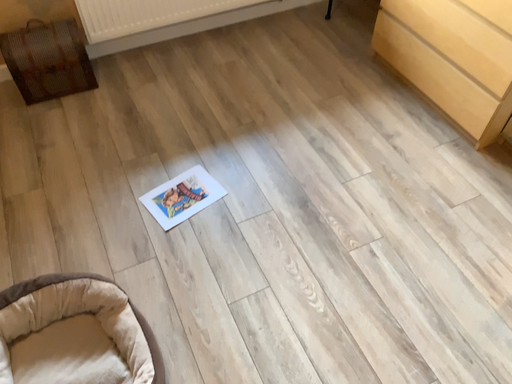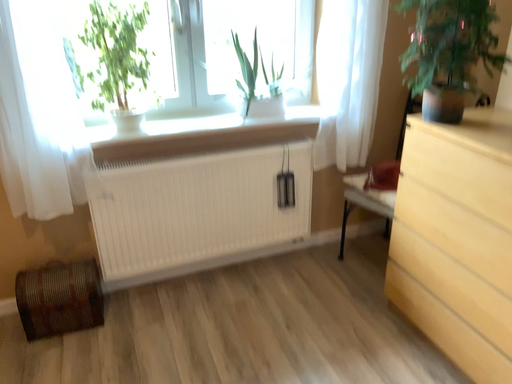
Question: Which way did the camera rotate in the video?

Choices:
 (A) rotated upward
 (B) rotated downward

Answer: (A)